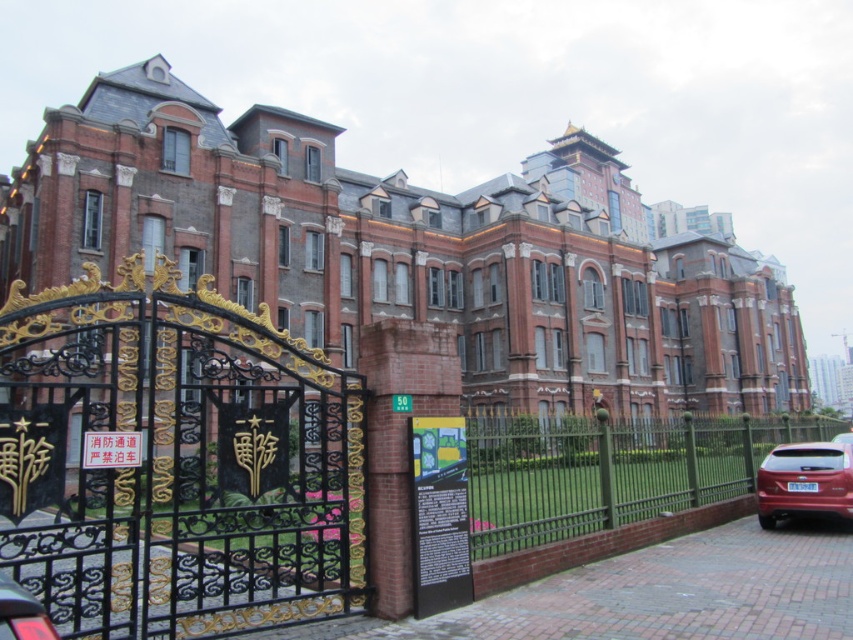
Question: Does black wrought iron gate at left appear on the right side of shiny red suv at right?

Choices:
 (A) yes
 (B) no

Answer: (B)

Question: Which object is the closest to the green metal fence at right?

Choices:
 (A) shiny red suv at right
 (B) black wrought iron gate at left

Answer: (A)

Question: Can you confirm if black wrought iron gate at left is thinner than green metal fence at right?

Choices:
 (A) no
 (B) yes

Answer: (B)

Question: Which of these objects is positioned closest to the green metal fence at right?

Choices:
 (A) shiny red suv at right
 (B) black wrought iron gate at left

Answer: (A)

Question: Which point is closer to the camera taking this photo?

Choices:
 (A) (799, 442)
 (B) (1, 483)
 (C) (537, 468)

Answer: (B)

Question: Can you confirm if black wrought iron gate at left is wider than green metal fence at right?

Choices:
 (A) no
 (B) yes

Answer: (A)